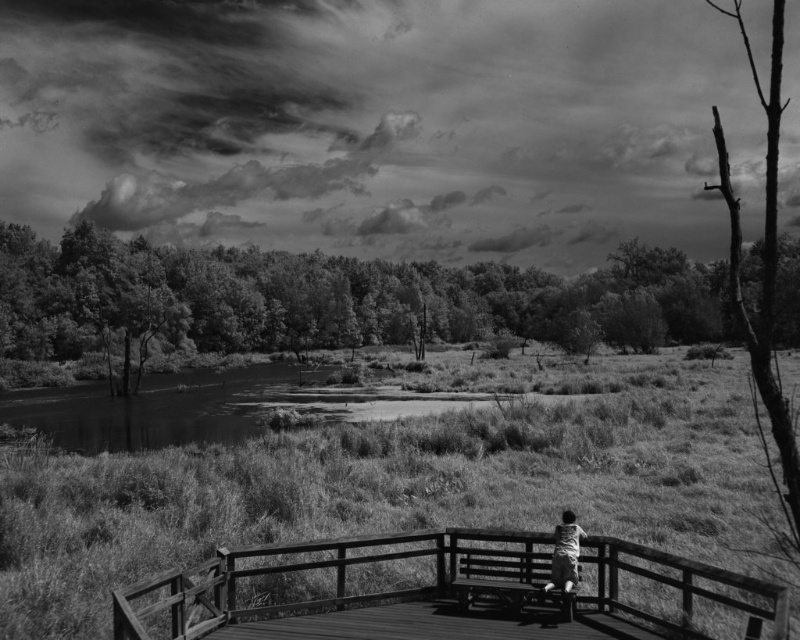
Does wooden picnic table at center appear over light gray fabric shirt at center?

No, wooden picnic table at center is not above light gray fabric shirt at center.

Between point (513, 604) and point (558, 561), which one is positioned in front?

Positioned in front is point (558, 561).

Locate an element on the screen. This screenshot has width=800, height=640. wooden picnic table at center is located at coordinates (513, 593).

What do you see at coordinates (204, 406) in the screenshot? The width and height of the screenshot is (800, 640). I see `smooth water at lower left` at bounding box center [204, 406].

Who is more forward, (92, 417) or (548, 586)?

Point (548, 586) is more forward.

Does point (202, 378) come closer to viewer compared to point (572, 545)?

No, it is behind (572, 545).

Where is `smooth water at lower left`? The image size is (800, 640). smooth water at lower left is located at coordinates (204, 406).

Is wooden bridge at lower center closer to the viewer compared to smooth water at lower left?

That is True.

The image size is (800, 640). What do you see at coordinates (448, 593) in the screenshot? I see `wooden bridge at lower center` at bounding box center [448, 593].

Is point (458, 568) positioned after point (248, 387)?

No, (458, 568) is closer to viewer.

Image resolution: width=800 pixels, height=640 pixels. What are the coordinates of `wooden bridge at lower center` in the screenshot? It's located at (448, 593).